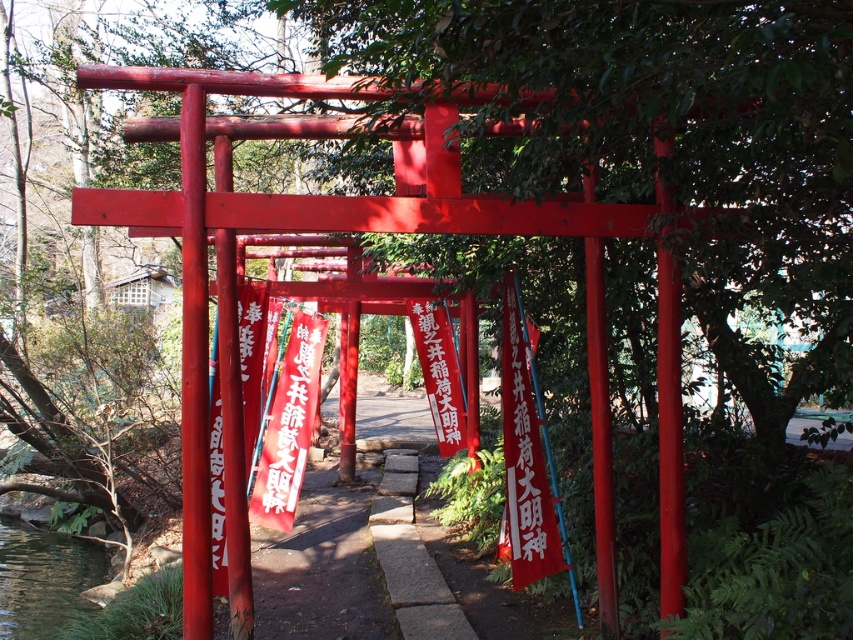
Is point (62, 570) less distant than point (437, 417)?

Yes, point (62, 570) is closer to viewer.

Who is lower down, clear water at lower left or red paper banner at center?

Positioned lower is clear water at lower left.

Which is in front, point (39, 545) or point (433, 333)?

Positioned in front is point (433, 333).

The image size is (853, 640). I want to click on clear water at lower left, so click(x=44, y=579).